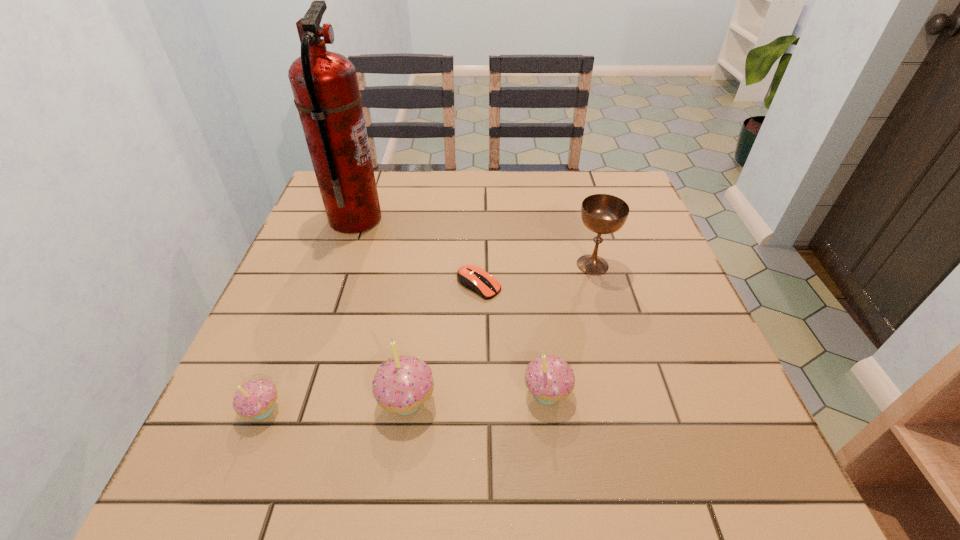
The width and height of the screenshot is (960, 540). In order to click on the second shortest object in this screenshot , I will do `click(255, 399)`.

Find the location of a particular element. The width and height of the screenshot is (960, 540). the leftmost cupcake is located at coordinates (255, 399).

The width and height of the screenshot is (960, 540). Identify the location of the second cupcake from right to left. (401, 385).

Locate an element on the screen. the fourth object from right to left is located at coordinates (401, 385).

I want to click on the rightmost cupcake, so click(x=549, y=378).

What are the coordinates of `the second shortest cupcake` in the screenshot? It's located at (549, 378).

You are a GUI agent. You are given a task and a screenshot of the screen. Output one action in this format:
    pyautogui.click(x=<x>, y=<y>)
    Task: Click on the tallest object
    
    Given the screenshot: What is the action you would take?
    pyautogui.click(x=326, y=93)

The height and width of the screenshot is (540, 960). I want to click on fire extinguisher, so click(326, 93).

Locate an element on the screen. The image size is (960, 540). computer mouse is located at coordinates (474, 278).

Locate an element on the screen. the third object from right to left is located at coordinates (474, 278).